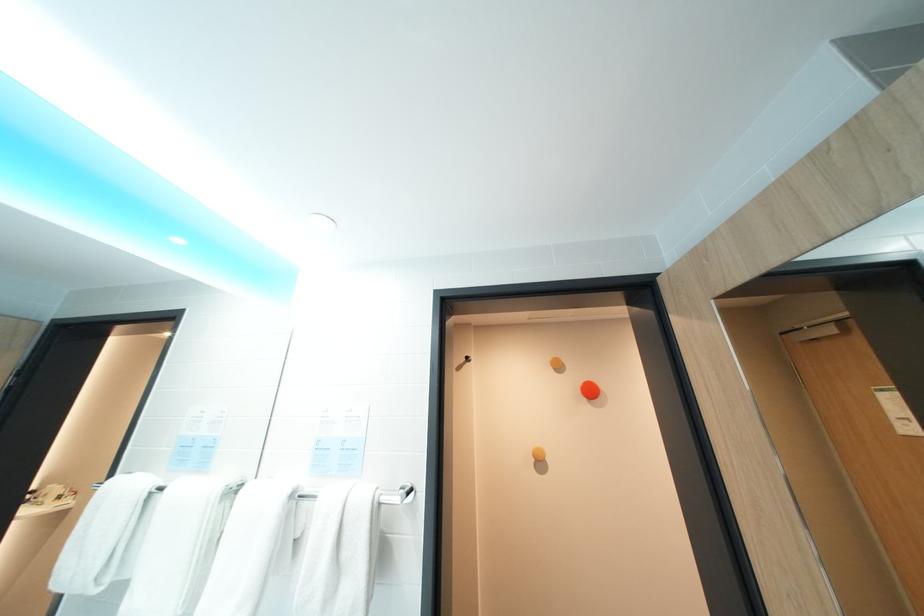
Image resolution: width=924 pixels, height=616 pixels. Find the location of `red circular hook`. red circular hook is located at coordinates (590, 390).